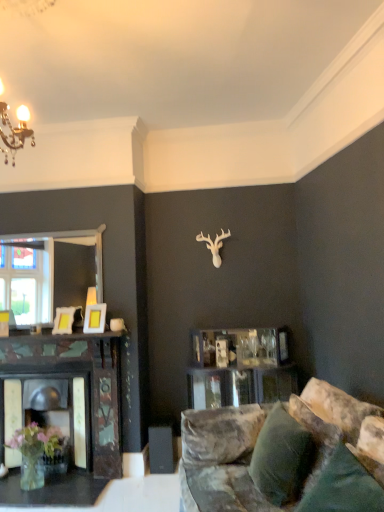
Where is `matte gold picture frame at left, placed as the second picture frame when sorted from right to left`? The image size is (384, 512). matte gold picture frame at left, placed as the second picture frame when sorted from right to left is located at coordinates click(64, 320).

Identify the location of matte gold picture frame at left, the first picture frame when ordered from left to right. (64, 320).

Does matte gold picture frame at left, placed as the second picture frame when sorted from right to left, have a lesser height compared to velvety green pillow at lower right, arranged as the first pillow when viewed from the front?

Yes.

Is matte gold picture frame at left, placed as the second picture frame when sorted from right to left, not within velvety green pillow at lower right, the second pillow from the back?

Yes, matte gold picture frame at left, placed as the second picture frame when sorted from right to left, is not within velvety green pillow at lower right, the second pillow from the back.

How much distance is there between matte gold picture frame at left, placed as the second picture frame when sorted from right to left, and velvety green pillow at lower right, the second pillow from the back?

matte gold picture frame at left, placed as the second picture frame when sorted from right to left, and velvety green pillow at lower right, the second pillow from the back, are 8.28 feet apart from each other.

Is point (75, 310) behind point (342, 448)?

Yes.

Does point (21, 490) come in front of point (278, 459)?

No, it is not.

How many degrees apart are the facing directions of clear glass vase at lower left and velvet green pillow at lower right, the second pillow in the front-to-back sequence?

74.1 degrees separate the facing orientations of clear glass vase at lower left and velvet green pillow at lower right, the second pillow in the front-to-back sequence.

Is clear glass vase at lower left taller or shorter than velvet green pillow at lower right, placed as the first pillow when sorted from back to front?

In the image, clear glass vase at lower left appears to be shorter than velvet green pillow at lower right, placed as the first pillow when sorted from back to front.

Does velvety green pillow at lower right, the second pillow from the back, have a smaller size compared to clear glass vase at lower left?

No, velvety green pillow at lower right, the second pillow from the back, is not smaller than clear glass vase at lower left.

Does velvety green pillow at lower right, arranged as the first pillow when viewed from the front, appear on the left side of clear glass vase at lower left?

In fact, velvety green pillow at lower right, arranged as the first pillow when viewed from the front, is to the right of clear glass vase at lower left.

In terms of width, does velvety green pillow at lower right, the second pillow from the back, look wider or thinner when compared to clear glass vase at lower left?

In the image, velvety green pillow at lower right, the second pillow from the back, appears to be more narrow than clear glass vase at lower left.

Is clear glass vase at lower left inside velvety green pillow at lower right, the second pillow from the back?

No.

Is matte yellow picture frame at center, marked as the first picture frame in a right-to-left arrangement, oriented away from matte gold picture frame at left, placed as the second picture frame when sorted from right to left?

matte yellow picture frame at center, marked as the first picture frame in a right-to-left arrangement, does not have its back to matte gold picture frame at left, placed as the second picture frame when sorted from right to left.

Which is more to the right, matte yellow picture frame at center, marked as the first picture frame in a right-to-left arrangement, or matte gold picture frame at left, the first picture frame when ordered from left to right?

matte yellow picture frame at center, marked as the first picture frame in a right-to-left arrangement, is more to the right.

Is matte yellow picture frame at center, marked as the first picture frame in a right-to-left arrangement, thinner than matte gold picture frame at left, the first picture frame when ordered from left to right?

Incorrect, the width of matte yellow picture frame at center, marked as the first picture frame in a right-to-left arrangement, is not less than that of matte gold picture frame at left, the first picture frame when ordered from left to right.

How many degrees apart are the facing directions of matte yellow picture frame at center, marked as the first picture frame in a right-to-left arrangement, and matte gold picture frame at left, placed as the second picture frame when sorted from right to left?

The facing directions of matte yellow picture frame at center, marked as the first picture frame in a right-to-left arrangement, and matte gold picture frame at left, placed as the second picture frame when sorted from right to left, are 0.0336 degrees apart.

Identify the location of table located in front of the matte yellow picture frame at center, the second picture frame positioned from the left. (52, 490).

Are matte yellow picture frame at center, the second picture frame positioned from the left, and clear glass vase at lower left making contact?

There is a gap between matte yellow picture frame at center, the second picture frame positioned from the left, and clear glass vase at lower left.

From the picture: Which of these two, matte yellow picture frame at center, the second picture frame positioned from the left, or clear glass vase at lower left, is thinner?

Thinner between the two is matte yellow picture frame at center, the second picture frame positioned from the left.

Could you measure the distance between matte yellow picture frame at center, the second picture frame positioned from the left, and clear glass vase at lower left?

matte yellow picture frame at center, the second picture frame positioned from the left, and clear glass vase at lower left are 4.16 feet apart.

Which of these two, velvety green pillow at lower right, arranged as the first pillow when viewed from the front, or matte gold picture frame at left, the first picture frame when ordered from left to right, is bigger?

With larger size is velvety green pillow at lower right, arranged as the first pillow when viewed from the front.

Looking at this image, is velvety green pillow at lower right, arranged as the first pillow when viewed from the front, positioned far away from matte gold picture frame at left, the first picture frame when ordered from left to right?

Yes, velvety green pillow at lower right, arranged as the first pillow when viewed from the front, and matte gold picture frame at left, the first picture frame when ordered from left to right, are quite far apart.

Is point (351, 473) farther from viewer compared to point (69, 311)?

No, it is not.

Consider the image. From a real-world perspective, is velvety green pillow at lower right, arranged as the first pillow when viewed from the front, positioned above or below matte gold picture frame at left, placed as the second picture frame when sorted from right to left?

Clearly, from a real-world perspective, velvety green pillow at lower right, arranged as the first pillow when viewed from the front, is below matte gold picture frame at left, placed as the second picture frame when sorted from right to left.

Is matte gold picture frame at left, placed as the second picture frame when sorted from right to left, looking in the opposite direction of matte yellow picture frame at center, the second picture frame positioned from the left?

No, matte gold picture frame at left, placed as the second picture frame when sorted from right to left,'s orientation is not away from matte yellow picture frame at center, the second picture frame positioned from the left.

Which object is thinner, matte gold picture frame at left, placed as the second picture frame when sorted from right to left, or matte yellow picture frame at center, marked as the first picture frame in a right-to-left arrangement?

matte gold picture frame at left, placed as the second picture frame when sorted from right to left, is thinner.

Based on their sizes in the image, would you say matte gold picture frame at left, placed as the second picture frame when sorted from right to left, is bigger or smaller than matte yellow picture frame at center, marked as the first picture frame in a right-to-left arrangement?

Considering their sizes, matte gold picture frame at left, placed as the second picture frame when sorted from right to left, takes up less space than matte yellow picture frame at center, marked as the first picture frame in a right-to-left arrangement.

Is the position of matte gold picture frame at left, the first picture frame when ordered from left to right, less distant than that of matte yellow picture frame at center, the second picture frame positioned from the left?

No, it is not.

This screenshot has height=512, width=384. I want to click on picture frame that is the 1st object located above the velvety green pillow at lower right, arranged as the first pillow when viewed from the front (from the image's perspective), so coord(64,320).

You are a GUI agent. You are given a task and a screenshot of the screen. Output one action in this format:
    pyautogui.click(x=<x>, y=<y>)
    Task: Click on the table to the left of velvet green pillow at lower right, placed as the first pillow when sorted from back to front
    This screenshot has height=512, width=384.
    Given the screenshot: What is the action you would take?
    pyautogui.click(x=52, y=490)

Based on their spatial positions, is matte gold picture frame at left, the first picture frame when ordered from left to right, or velvet green pillow at lower right, placed as the first pillow when sorted from back to front, closer to matte yellow picture frame at center, the second picture frame positioned from the left?

matte gold picture frame at left, the first picture frame when ordered from left to right, lies closer to matte yellow picture frame at center, the second picture frame positioned from the left, than the other object.

Considering their positions, is matte yellow picture frame at center, marked as the first picture frame in a right-to-left arrangement, positioned closer to velvet green pillow at lower right, placed as the first pillow when sorted from back to front, than matte gold picture frame at left, the first picture frame when ordered from left to right?

matte yellow picture frame at center, marked as the first picture frame in a right-to-left arrangement, is closer to velvet green pillow at lower right, placed as the first pillow when sorted from back to front.

Looking at the image, which one is located closer to clear glass vase at lower left, velvet green pillow at lower right, placed as the first pillow when sorted from back to front, or velvety green pillow at lower right, arranged as the first pillow when viewed from the front?

velvet green pillow at lower right, placed as the first pillow when sorted from back to front, is closer to clear glass vase at lower left.

Estimate the real-world distances between objects in this image. Which object is closer to velvety green pillow at lower right, the second pillow from the back, velvet green pillow at lower right, placed as the first pillow when sorted from back to front, or matte yellow picture frame at center, marked as the first picture frame in a right-to-left arrangement?

velvet green pillow at lower right, placed as the first pillow when sorted from back to front.

Which object lies nearer to the anchor point velvet green pillow at lower right, placed as the first pillow when sorted from back to front, clear glass vase at lower left or matte gold picture frame at left, the first picture frame when ordered from left to right?

Based on the image, clear glass vase at lower left appears to be nearer to velvet green pillow at lower right, placed as the first pillow when sorted from back to front.

Estimate the real-world distances between objects in this image. Which object is further from velvety green pillow at lower right, the second pillow from the back, velvet green pillow at lower right, placed as the first pillow when sorted from back to front, or matte gold picture frame at left, placed as the second picture frame when sorted from right to left?

Among the two, matte gold picture frame at left, placed as the second picture frame when sorted from right to left, is located further to velvety green pillow at lower right, the second pillow from the back.

From the image, which object appears to be farther from matte yellow picture frame at center, marked as the first picture frame in a right-to-left arrangement, velvet green pillow at lower right, placed as the first pillow when sorted from back to front, or matte gold picture frame at left, placed as the second picture frame when sorted from right to left?

velvet green pillow at lower right, placed as the first pillow when sorted from back to front, lies further to matte yellow picture frame at center, marked as the first picture frame in a right-to-left arrangement, than the other object.

Considering their positions, is matte yellow picture frame at center, marked as the first picture frame in a right-to-left arrangement, positioned further to matte gold picture frame at left, placed as the second picture frame when sorted from right to left, than velvety green pillow at lower right, the second pillow from the back?

velvety green pillow at lower right, the second pillow from the back.

Find the location of a particular element. pillow between velvety green pillow at lower right, the second pillow from the back, and matte gold picture frame at left, the first picture frame when ordered from left to right, along the z-axis is located at coordinates (281, 457).

Find the location of a particular element. Image resolution: width=384 pixels, height=512 pixels. pillow between velvety green pillow at lower right, the second pillow from the back, and matte yellow picture frame at center, marked as the first picture frame in a right-to-left arrangement, from front to back is located at coordinates (281, 457).

Locate an element on the screen. The image size is (384, 512). picture frame between matte yellow picture frame at center, the second picture frame positioned from the left, and clear glass vase at lower left vertically is located at coordinates (64, 320).

Where is `picture frame between velvety green pillow at lower right, the second pillow from the back, and matte gold picture frame at left, placed as the second picture frame when sorted from right to left, along the z-axis`? Image resolution: width=384 pixels, height=512 pixels. picture frame between velvety green pillow at lower right, the second pillow from the back, and matte gold picture frame at left, placed as the second picture frame when sorted from right to left, along the z-axis is located at coordinates (95, 318).